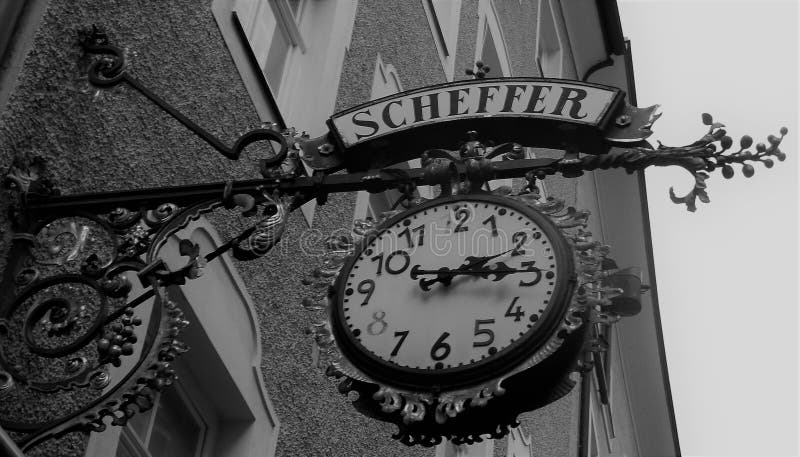
I want to click on clock hour hand, so click(477, 261).